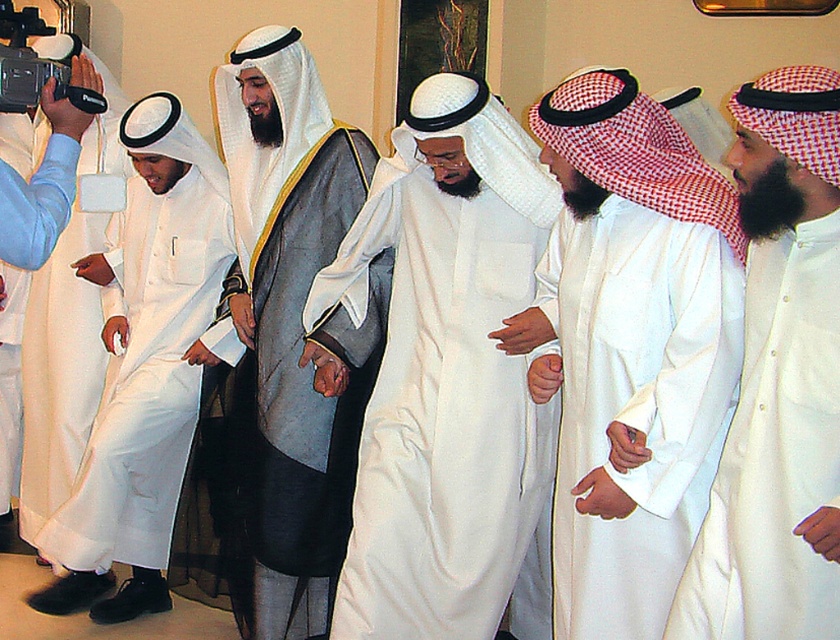
You are a tailor measuring two white robes displayed at the center of a traditional Middle Eastern setting. Which robe has a taller length between the white matte robe at center and the white satin robe at center?

The white matte robe at center has a greater height compared to the white satin robe at center, so the white matte robe at center is taller.

You are organizing a photo shoot and need to ensure that two outfits, the white satin robe at center and the white matte kandura at center, can fit side by side on a mannequin stand. Based on the scene, can you determine if they can fit without overlapping?

The white satin robe at center might be wider than the white matte kandura at center, so there is a possibility that they may overlap when placed side by side on the mannequin stand. Check the exact measurements to confirm.